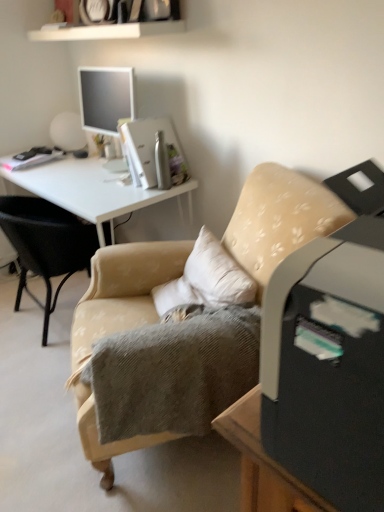
Question: Considering the relative sizes of white glossy desk at upper left and beige fabric chair at center, which ranks as the first chair in left-to-right order, in the image provided, is white glossy desk at upper left shorter than beige fabric chair at center, which ranks as the first chair in left-to-right order,?

Choices:
 (A) no
 (B) yes

Answer: (A)

Question: Can you confirm if white glossy desk at upper left is wider than beige fabric chair at center, which appears as the 2th chair when viewed from the right?

Choices:
 (A) yes
 (B) no

Answer: (A)

Question: Considering the relative sizes of white glossy desk at upper left and beige fabric chair at center, which ranks as the first chair in left-to-right order, in the image provided, is white glossy desk at upper left thinner than beige fabric chair at center, which ranks as the first chair in left-to-right order,?

Choices:
 (A) no
 (B) yes

Answer: (A)

Question: From the image's perspective, does white glossy desk at upper left appear higher than beige fabric chair at center, which ranks as the first chair in left-to-right order?

Choices:
 (A) no
 (B) yes

Answer: (B)

Question: Does white glossy desk at upper left lie in front of beige fabric chair at center, which ranks as the first chair in left-to-right order?

Choices:
 (A) no
 (B) yes

Answer: (A)

Question: Would you say white glossy desk at upper left is to the left or to the right of beige fabric chair at center, which ranks as the 1th chair in right-to-left order, in the picture?

Choices:
 (A) right
 (B) left

Answer: (B)

Question: Does point (96, 192) appear closer or farther from the camera than point (117, 298)?

Choices:
 (A) farther
 (B) closer

Answer: (A)

Question: From a real-world perspective, is white glossy desk at upper left above or below beige fabric chair at center, marked as the second chair in a left-to-right arrangement?

Choices:
 (A) below
 (B) above

Answer: (A)

Question: Considering their positions, is white glossy desk at upper left located in front of or behind beige fabric chair at center, marked as the second chair in a left-to-right arrangement?

Choices:
 (A) front
 (B) behind

Answer: (B)

Question: From a real-world perspective, relative to white glossy desk at upper left, is beige fabric chair at center, which ranks as the first chair in left-to-right order, vertically above or below?

Choices:
 (A) below
 (B) above

Answer: (A)

Question: In terms of size, does beige fabric chair at center, which ranks as the first chair in left-to-right order, appear bigger or smaller than white glossy desk at upper left?

Choices:
 (A) small
 (B) big

Answer: (A)

Question: Considering their positions, is beige fabric chair at center, which appears as the 2th chair when viewed from the right, located in front of or behind white glossy desk at upper left?

Choices:
 (A) behind
 (B) front

Answer: (B)

Question: Is beige fabric chair at center, which appears as the 2th chair when viewed from the right, situated inside white glossy desk at upper left or outside?

Choices:
 (A) inside
 (B) outside

Answer: (A)

Question: Considering the positions of point (258, 210) and point (122, 211), is point (258, 210) closer or farther from the camera than point (122, 211)?

Choices:
 (A) closer
 (B) farther

Answer: (A)

Question: Is beige fabric chair at center, marked as the second chair in a left-to-right arrangement, in front of or behind white glossy desk at upper left in the image?

Choices:
 (A) behind
 (B) front

Answer: (B)